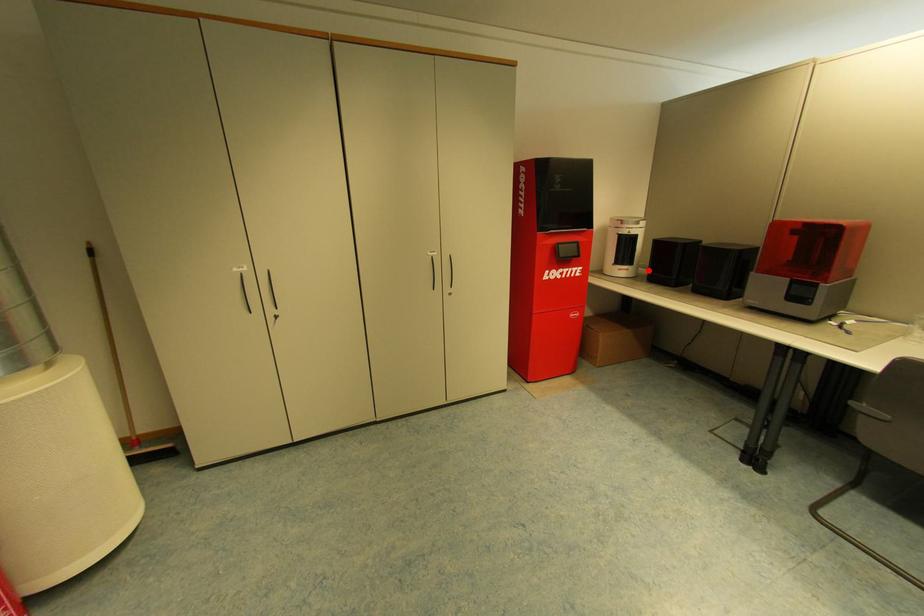
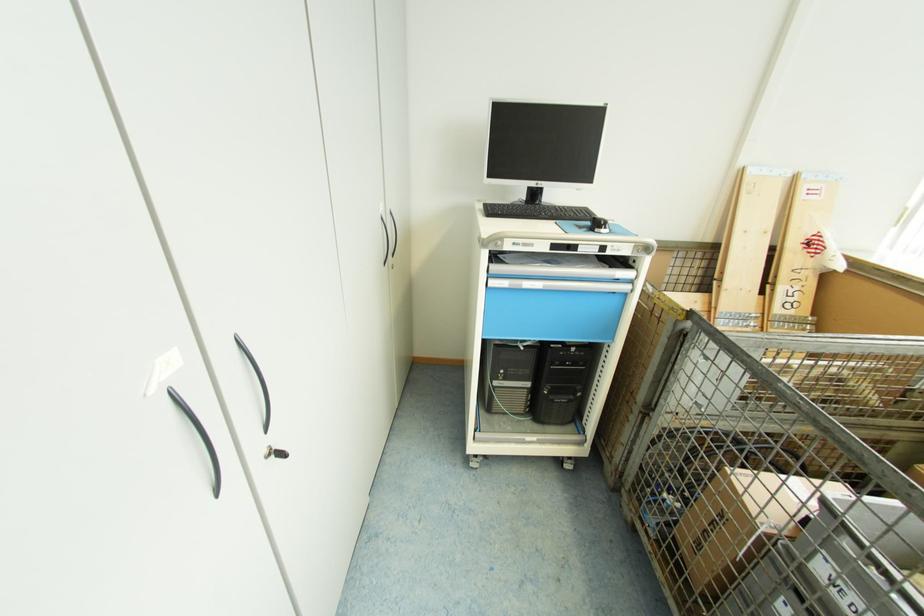
Question: I am providing you with two images of the same scene from different viewpoints. A red point is marked on the first image. Can you still see the location of the red point in image 2?

Choices:
 (A) Yes
 (B) No

Answer: (B)